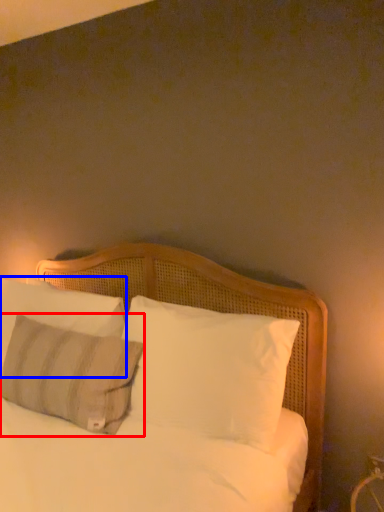
Question: Among these objects, which one is farthest to the camera, pillow (highlighted by a red box) or pillow (highlighted by a blue box)?

Choices:
 (A) pillow
 (B) pillow

Answer: (B)